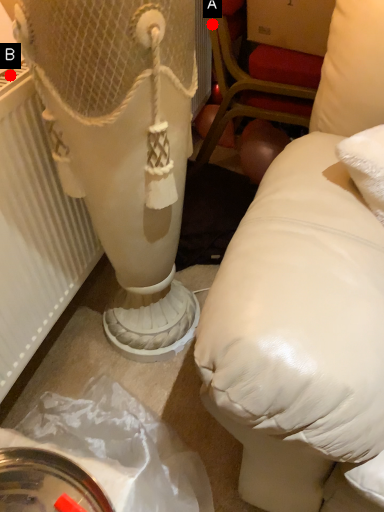
Question: Two points are circled on the image, labeled by A and B beside each circle. Which point appears closest to the camera in this image?

Choices:
 (A) A is closer
 (B) B is closer

Answer: (B)